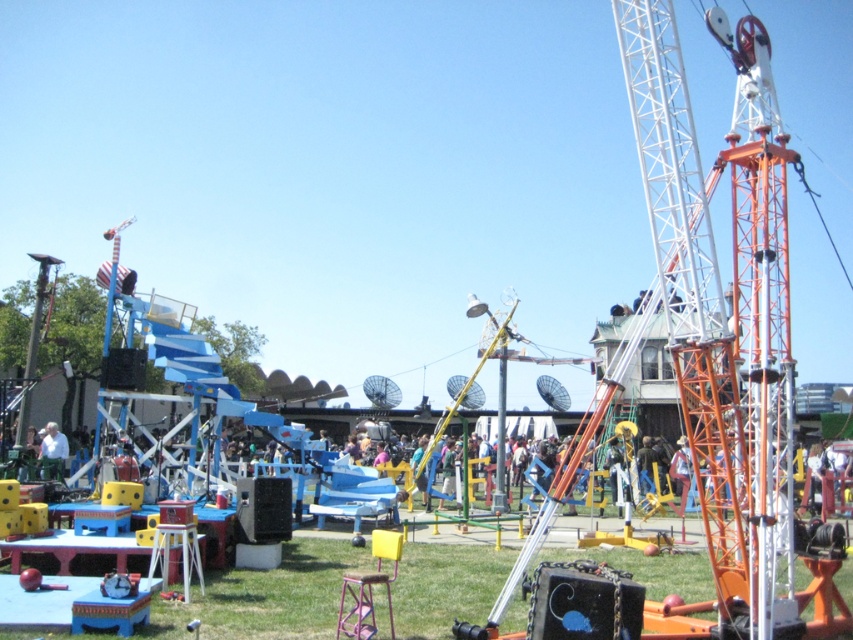
Does orange metallic crane at right appear under light blue shirt at lower left?

Actually, orange metallic crane at right is above light blue shirt at lower left.

In the scene shown: Does orange metallic crane at right have a lesser height compared to light blue shirt at lower left?

No, orange metallic crane at right is not shorter than light blue shirt at lower left.

Between point (751, 244) and point (45, 435), which one is positioned in front?

Point (751, 244)

Where is `orange metallic crane at right`? The width and height of the screenshot is (853, 640). orange metallic crane at right is located at coordinates (721, 308).